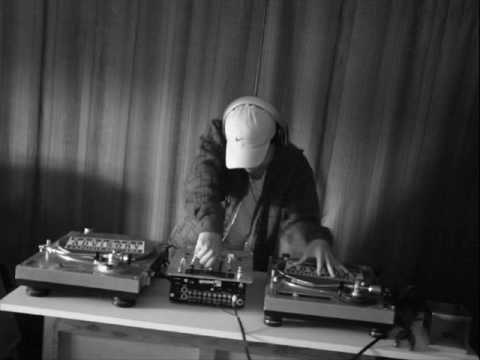
Where is `desk`? This screenshot has width=480, height=360. desk is located at coordinates tap(161, 329).